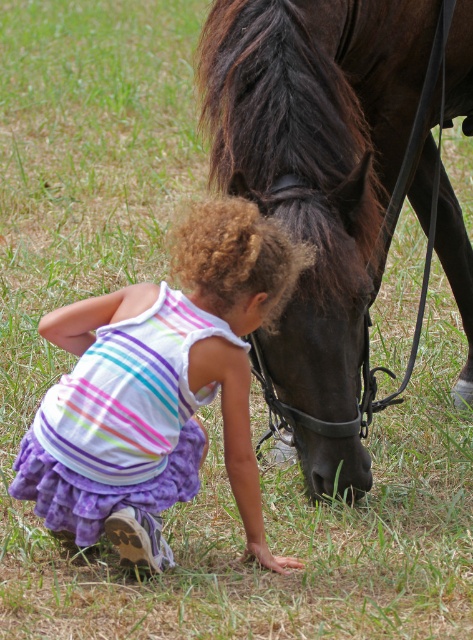
Between shiny dark brown horse at center and striped fabric dress at lower center, which one appears on the left side from the viewer's perspective?

From the viewer's perspective, striped fabric dress at lower center appears more on the left side.

Measure the distance between point (455, 54) and camera.

They are 10.94 feet apart.

Identify the location of shiny dark brown horse at center. This screenshot has width=473, height=640. (315, 157).